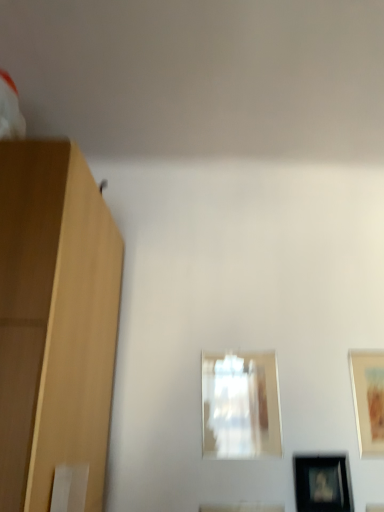
How much space does transparent glass picture frame at center, which is the 3th picture frame from right to left, occupy vertically?

transparent glass picture frame at center, which is the 3th picture frame from right to left, is 32.38 centimeters tall.

Describe the element at coordinates (241, 405) in the screenshot. I see `transparent glass picture frame at center, which is the 3th picture frame from right to left` at that location.

What do you see at coordinates (368, 399) in the screenshot?
I see `matte wooden picture frame at right, which ranks as the 1th picture frame in right-to-left order` at bounding box center [368, 399].

Describe the element at coordinates (322, 483) in the screenshot. I see `black glossy picture frame at lower right, the 2th picture frame when ordered from left to right` at that location.

I want to click on transparent glass picture frame at center, which is the 3th picture frame from right to left, so click(x=241, y=405).

Would you say black glossy picture frame at lower right, positioned as the second picture frame in right-to-left order, is outside matte wooden picture frame at right, which ranks as the 1th picture frame in right-to-left order?

Yes, black glossy picture frame at lower right, positioned as the second picture frame in right-to-left order, is not within matte wooden picture frame at right, which ranks as the 1th picture frame in right-to-left order.

Is black glossy picture frame at lower right, positioned as the second picture frame in right-to-left order, in front of or behind matte wooden picture frame at right, placed as the 3th picture frame when sorted from left to right, in the image?

black glossy picture frame at lower right, positioned as the second picture frame in right-to-left order, is in front of matte wooden picture frame at right, placed as the 3th picture frame when sorted from left to right.

Measure the distance between black glossy picture frame at lower right, the 2th picture frame when ordered from left to right, and matte wooden picture frame at right, placed as the 3th picture frame when sorted from left to right.

black glossy picture frame at lower right, the 2th picture frame when ordered from left to right, is 6.88 inches from matte wooden picture frame at right, placed as the 3th picture frame when sorted from left to right.

From the image's perspective, does black glossy picture frame at lower right, positioned as the second picture frame in right-to-left order, appear lower than matte wooden picture frame at right, placed as the 3th picture frame when sorted from left to right?

Yes, from the image's perspective, black glossy picture frame at lower right, positioned as the second picture frame in right-to-left order, is below matte wooden picture frame at right, placed as the 3th picture frame when sorted from left to right.

Does point (368, 443) appear closer or farther from the camera than point (232, 454)?

Point (368, 443) is positioned farther from the camera compared to point (232, 454).

Which of these two, matte wooden picture frame at right, which ranks as the 1th picture frame in right-to-left order, or transparent glass picture frame at center, which is the 3th picture frame from right to left, stands taller?

transparent glass picture frame at center, which is the 3th picture frame from right to left.

From a real-world perspective, is matte wooden picture frame at right, which ranks as the 1th picture frame in right-to-left order, positioned above or below transparent glass picture frame at center, which is the 3th picture frame from right to left?

Clearly, from a real-world perspective, matte wooden picture frame at right, which ranks as the 1th picture frame in right-to-left order, is above transparent glass picture frame at center, which is the 3th picture frame from right to left.

Who is smaller, matte wooden picture frame at right, placed as the 3th picture frame when sorted from left to right, or transparent glass picture frame at center, the 1th picture frame positioned from the left?

Smaller between the two is matte wooden picture frame at right, placed as the 3th picture frame when sorted from left to right.

Based on the photo, which is correct: black glossy picture frame at lower right, positioned as the second picture frame in right-to-left order, is inside transparent glass picture frame at center, the 1th picture frame positioned from the left, or outside of it?

The correct answer is: outside.

Which of these two, black glossy picture frame at lower right, positioned as the second picture frame in right-to-left order, or transparent glass picture frame at center, the 1th picture frame positioned from the left, is wider?

black glossy picture frame at lower right, positioned as the second picture frame in right-to-left order, is wider.

Between point (319, 501) and point (239, 375), which one is positioned in front?

Positioned in front is point (319, 501).

From the image's perspective, which object appears higher, matte wooden picture frame at right, placed as the 3th picture frame when sorted from left to right, or black glossy picture frame at lower right, positioned as the second picture frame in right-to-left order?

matte wooden picture frame at right, placed as the 3th picture frame when sorted from left to right, is shown above in the image.

Could you measure the distance between matte wooden picture frame at right, placed as the 3th picture frame when sorted from left to right, and black glossy picture frame at lower right, positioned as the second picture frame in right-to-left order?

matte wooden picture frame at right, placed as the 3th picture frame when sorted from left to right, and black glossy picture frame at lower right, positioned as the second picture frame in right-to-left order, are 6.88 inches apart from each other.

Which of these two, matte wooden picture frame at right, placed as the 3th picture frame when sorted from left to right, or black glossy picture frame at lower right, the 2th picture frame when ordered from left to right, is thinner?

matte wooden picture frame at right, placed as the 3th picture frame when sorted from left to right, is thinner.

Does matte wooden picture frame at right, which ranks as the 1th picture frame in right-to-left order, have a lesser height compared to black glossy picture frame at lower right, positioned as the second picture frame in right-to-left order?

In fact, matte wooden picture frame at right, which ranks as the 1th picture frame in right-to-left order, may be taller than black glossy picture frame at lower right, positioned as the second picture frame in right-to-left order.

At what (x,y) coordinates should I click in order to perform the action: click on the 1st picture frame below the matte wooden picture frame at right, placed as the 3th picture frame when sorted from left to right (from the image's perspective). Please return your answer as a coordinate pair (x, y). The width and height of the screenshot is (384, 512). Looking at the image, I should click on (241, 405).

From the image's perspective, which is below, transparent glass picture frame at center, which is the 3th picture frame from right to left, or matte wooden picture frame at right, which ranks as the 1th picture frame in right-to-left order?

transparent glass picture frame at center, which is the 3th picture frame from right to left, is shown below in the image.

Considering the positions of objects transparent glass picture frame at center, which is the 3th picture frame from right to left, and matte wooden picture frame at right, which ranks as the 1th picture frame in right-to-left order, in the image provided, who is more to the right, transparent glass picture frame at center, which is the 3th picture frame from right to left, or matte wooden picture frame at right, which ranks as the 1th picture frame in right-to-left order,?

From the viewer's perspective, matte wooden picture frame at right, which ranks as the 1th picture frame in right-to-left order, appears more on the right side.

Is transparent glass picture frame at center, the 1th picture frame positioned from the left, aimed at black glossy picture frame at lower right, the 2th picture frame when ordered from left to right?

No.

Would you say transparent glass picture frame at center, the 1th picture frame positioned from the left, is outside black glossy picture frame at lower right, positioned as the second picture frame in right-to-left order?

transparent glass picture frame at center, the 1th picture frame positioned from the left, is positioned outside black glossy picture frame at lower right, positioned as the second picture frame in right-to-left order.

Is the position of transparent glass picture frame at center, which is the 3th picture frame from right to left, more distant than that of black glossy picture frame at lower right, positioned as the second picture frame in right-to-left order?

Yes.

From a real-world perspective, is transparent glass picture frame at center, which is the 3th picture frame from right to left, under black glossy picture frame at lower right, positioned as the second picture frame in right-to-left order?

No, from a real-world perspective, transparent glass picture frame at center, which is the 3th picture frame from right to left, is not beneath black glossy picture frame at lower right, positioned as the second picture frame in right-to-left order.

Where is `picture frame that is the 2nd object located below the matte wooden picture frame at right, which ranks as the 1th picture frame in right-to-left order (from the image's perspective)`? The width and height of the screenshot is (384, 512). picture frame that is the 2nd object located below the matte wooden picture frame at right, which ranks as the 1th picture frame in right-to-left order (from the image's perspective) is located at coordinates (322, 483).

Which picture frame is the 2nd one when counting from the right side of the transparent glass picture frame at center, the 1th picture frame positioned from the left? Please provide its 2D coordinates.

[(368, 399)]

Estimate the real-world distances between objects in this image. Which object is further from black glossy picture frame at lower right, positioned as the second picture frame in right-to-left order, matte wooden picture frame at right, which ranks as the 1th picture frame in right-to-left order, or transparent glass picture frame at center, which is the 3th picture frame from right to left?

transparent glass picture frame at center, which is the 3th picture frame from right to left, lies further to black glossy picture frame at lower right, positioned as the second picture frame in right-to-left order, than the other object.

Looking at the image, which one is located closer to matte wooden picture frame at right, placed as the 3th picture frame when sorted from left to right, black glossy picture frame at lower right, the 2th picture frame when ordered from left to right, or transparent glass picture frame at center, which is the 3th picture frame from right to left?

black glossy picture frame at lower right, the 2th picture frame when ordered from left to right, is positioned closer to the anchor matte wooden picture frame at right, placed as the 3th picture frame when sorted from left to right.

Considering their positions, is matte wooden picture frame at right, which ranks as the 1th picture frame in right-to-left order, positioned closer to transparent glass picture frame at center, the 1th picture frame positioned from the left, than black glossy picture frame at lower right, the 2th picture frame when ordered from left to right?

Among the two, black glossy picture frame at lower right, the 2th picture frame when ordered from left to right, is located nearer to transparent glass picture frame at center, the 1th picture frame positioned from the left.

When comparing their distances from black glossy picture frame at lower right, the 2th picture frame when ordered from left to right, does transparent glass picture frame at center, which is the 3th picture frame from right to left, or matte wooden picture frame at right, placed as the 3th picture frame when sorted from left to right, seem closer?

matte wooden picture frame at right, placed as the 3th picture frame when sorted from left to right, is positioned closer to the anchor black glossy picture frame at lower right, the 2th picture frame when ordered from left to right.

When comparing their distances from matte wooden picture frame at right, placed as the 3th picture frame when sorted from left to right, does transparent glass picture frame at center, which is the 3th picture frame from right to left, or black glossy picture frame at lower right, the 2th picture frame when ordered from left to right, seem closer?

black glossy picture frame at lower right, the 2th picture frame when ordered from left to right, lies closer to matte wooden picture frame at right, placed as the 3th picture frame when sorted from left to right, than the other object.

Based on their spatial positions, is black glossy picture frame at lower right, positioned as the second picture frame in right-to-left order, or matte wooden picture frame at right, placed as the 3th picture frame when sorted from left to right, further from transparent glass picture frame at center, which is the 3th picture frame from right to left?

The object further to transparent glass picture frame at center, which is the 3th picture frame from right to left, is matte wooden picture frame at right, placed as the 3th picture frame when sorted from left to right.

The width and height of the screenshot is (384, 512). I want to click on picture frame between transparent glass picture frame at center, the 1th picture frame positioned from the left, and matte wooden picture frame at right, which ranks as the 1th picture frame in right-to-left order, so click(x=322, y=483).